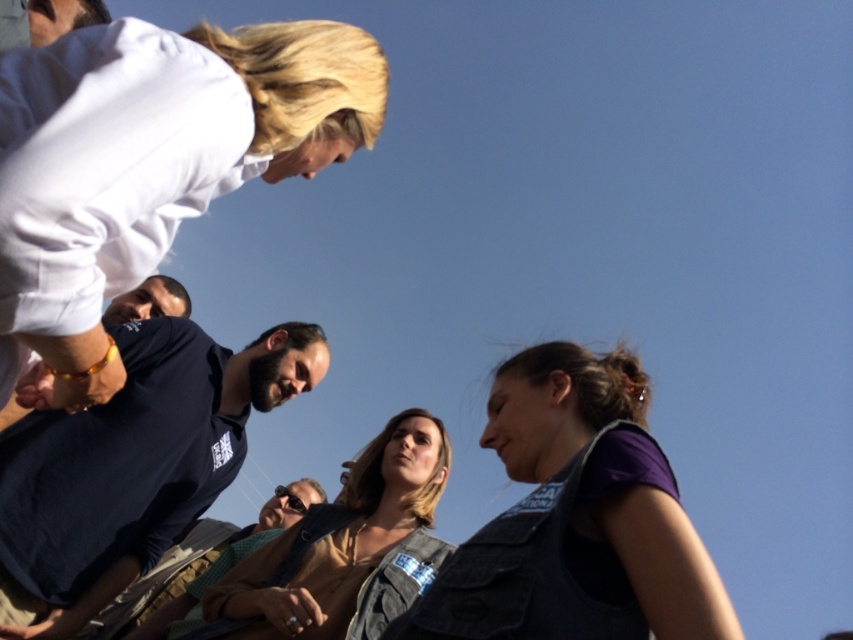
Is white matte shirt at upper left to the left of dark blue shirt at lower left from the viewer's perspective?

No, white matte shirt at upper left is not to the left of dark blue shirt at lower left.

Which is below, white matte shirt at upper left or dark blue shirt at lower left?

Positioned lower is white matte shirt at upper left.

Where is `white matte shirt at upper left`? white matte shirt at upper left is located at coordinates (149, 164).

Find the location of `white matte shirt at upper left`. white matte shirt at upper left is located at coordinates (149, 164).

Does dark blue shirt at center have a lesser width compared to green checkered shirt at center?

Indeed, dark blue shirt at center has a lesser width compared to green checkered shirt at center.

I want to click on dark blue shirt at center, so click(x=132, y=465).

Is point (96, 595) in front of point (254, 544)?

Yes, it is.

Where is `dark blue shirt at center`? dark blue shirt at center is located at coordinates (132, 465).

Does point (308, 554) come behind point (206, 570)?

No, (308, 554) is in front of (206, 570).

This screenshot has width=853, height=640. What do you see at coordinates (339, 540) in the screenshot?
I see `denim jacket at center` at bounding box center [339, 540].

Identify the location of denim jacket at center. The image size is (853, 640). (339, 540).